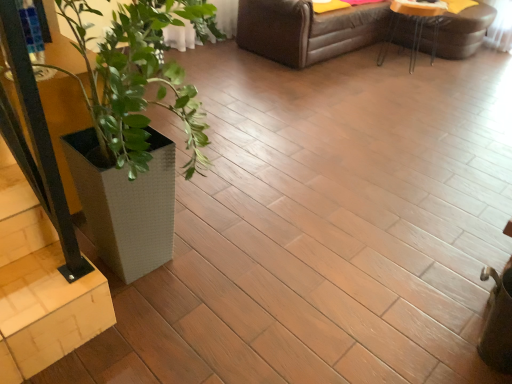
Locate an element on the screen. free spot above light wood stairwell at lower left (from a real-world perspective) is located at coordinates (38, 283).